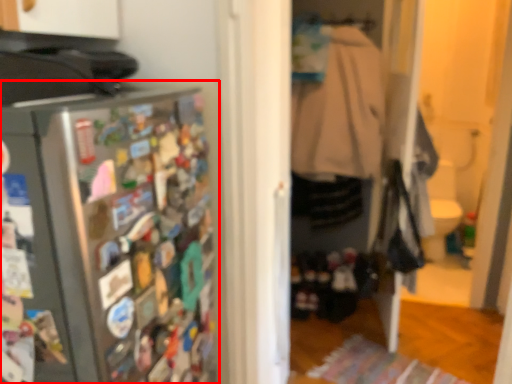
Question: In this image, where is refrigerator (annotated by the red box) located relative to clothing?

Choices:
 (A) right
 (B) left

Answer: (B)